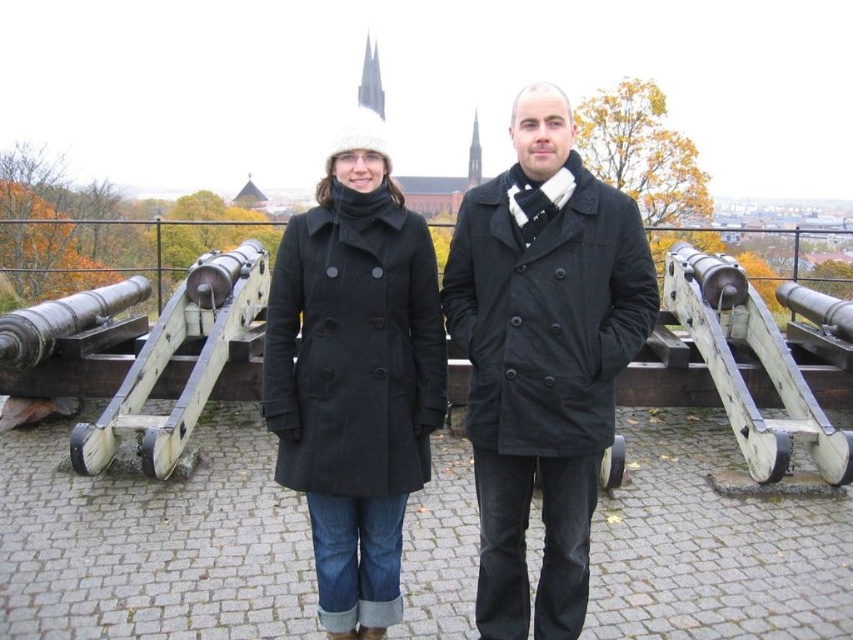
Question: In this image, where is matte black coat at center located relative to black woolen coat at center?

Choices:
 (A) above
 (B) below

Answer: (A)

Question: Which is nearer to the matte black coat at center?

Choices:
 (A) black woolen coat at center
 (B) wooden cannon at right
 (C) wooden cannon at center

Answer: (A)

Question: Estimate the real-world distances between objects in this image. Which object is closer to the wooden cannon at center?

Choices:
 (A) matte black coat at center
 (B) wooden cannon at right

Answer: (A)

Question: Considering the relative positions of matte black coat at center and wooden cannon at right in the image provided, where is matte black coat at center located with respect to wooden cannon at right?

Choices:
 (A) below
 (B) above

Answer: (B)

Question: Can you confirm if wooden cannon at right is smaller than wooden cannon at center?

Choices:
 (A) no
 (B) yes

Answer: (B)

Question: Which point is closer to the camera?

Choices:
 (A) black woolen coat at center
 (B) wooden cannon at center
 (C) matte black coat at center
 (D) wooden cannon at right

Answer: (C)